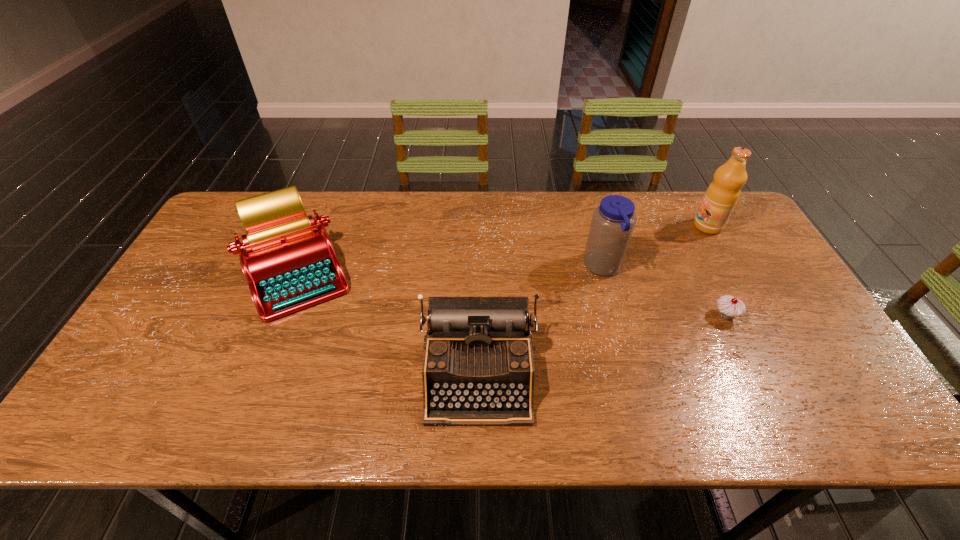
Locate an element on the screen. This screenshot has width=960, height=540. free space between the fourth shortest object and the cupcake is located at coordinates (664, 292).

I want to click on object that can be found as the second closest to the shortest object, so click(x=721, y=196).

Select which object appears as the fourth closest to the second object from right to left. Please provide its 2D coordinates. Your answer should be formatted as a tuple, i.e. [(x, y)], where the tuple contains the x and y coordinates of a point satisfying the conditions above.

[(289, 265)]

Image resolution: width=960 pixels, height=540 pixels. Identify the location of vacant space that satisfies the following two spatial constraints: 1. on the front label of the fruit juice; 2. on the front side of the fourth object from left to right. tap(757, 315).

This screenshot has height=540, width=960. Identify the location of vacant space that satisfies the following two spatial constraints: 1. with a carrying loop on the side of the water bottle; 2. on the keyboard of the second object from left to right. (632, 374).

Locate an element on the screen. The height and width of the screenshot is (540, 960). free location that satisfies the following two spatial constraints: 1. on the front label of the rightmost object; 2. on the keyboard of the nearest object is located at coordinates (791, 374).

Find the location of a particular element. blank space that satisfies the following two spatial constraints: 1. with a carrying loop on the side of the fourth shortest object; 2. on the typing side of the farther typewriter is located at coordinates (604, 272).

The image size is (960, 540). Find the location of `free space that satisfies the following two spatial constraints: 1. with a carrying loop on the side of the third object from right to left; 2. on the right side of the cupcake`. free space that satisfies the following two spatial constraints: 1. with a carrying loop on the side of the third object from right to left; 2. on the right side of the cupcake is located at coordinates (616, 315).

The width and height of the screenshot is (960, 540). In order to click on vacant area in the image that satisfies the following two spatial constraints: 1. on the front label of the fruit juice; 2. on the typing side of the leftmost object in this screenshot , I will do `click(733, 272)`.